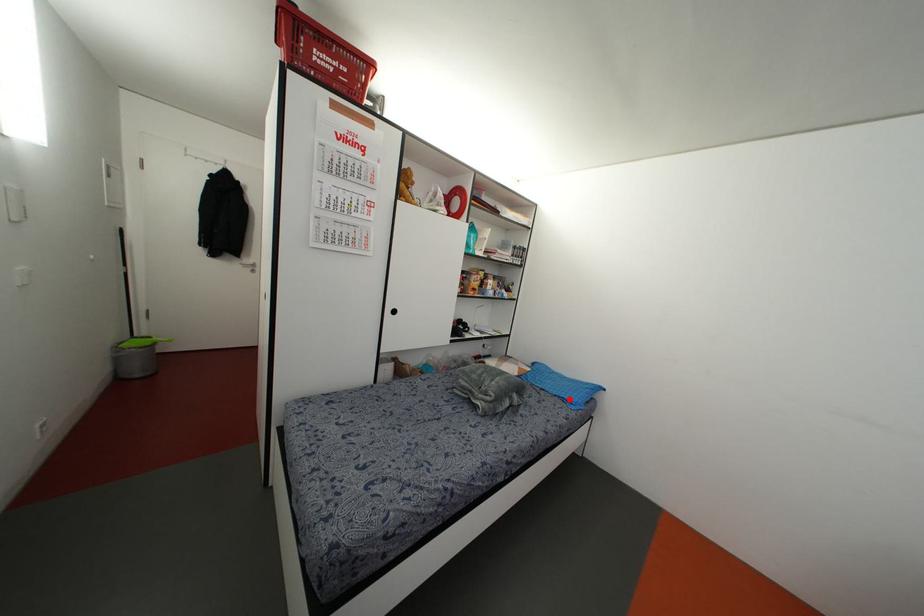
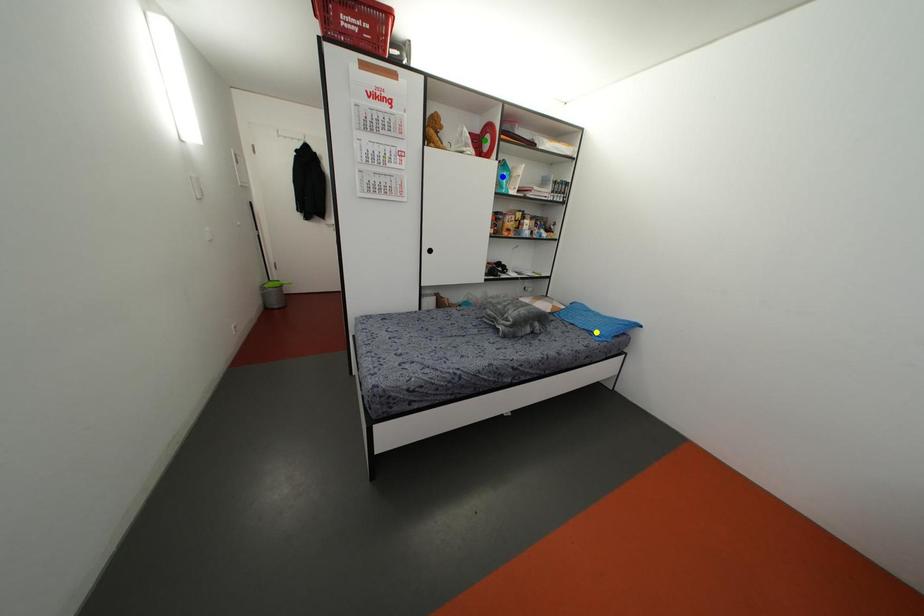
Question: I am providing you with two images of the same scene from different viewpoints. A red point is marked on the first image. You are given multiple points on the second image. Which point in image 2 is actually the same real-world point as the red point in image 1?

Choices:
 (A) green point
 (B) blue point
 (C) yellow point

Answer: (C)